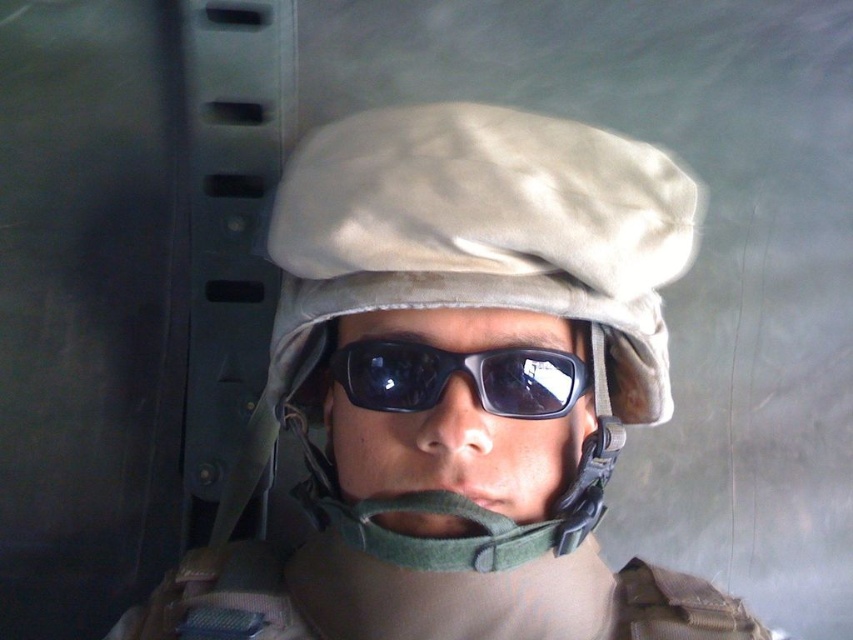
Describe the element at coordinates (485, 230) in the screenshot. I see `tan fabric helmet at center` at that location.

Between tan fabric helmet at center and black matte sunglasses at center, which one is positioned higher?

tan fabric helmet at center is higher up.

Is point (653, 182) positioned behind point (445, 352)?

Yes, point (653, 182) is behind point (445, 352).

Where is `tan fabric helmet at center`? tan fabric helmet at center is located at coordinates (485, 230).